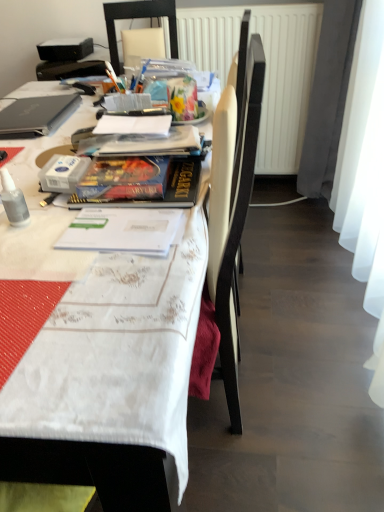
Question: Does white fabric table at upper left have a greater height compared to hardcover book at center?

Choices:
 (A) yes
 (B) no

Answer: (A)

Question: Is white fabric table at upper left looking in the opposite direction of hardcover book at center?

Choices:
 (A) no
 (B) yes

Answer: (A)

Question: From a real-world perspective, is white fabric table at upper left below hardcover book at center?

Choices:
 (A) no
 (B) yes

Answer: (B)

Question: Is white fabric table at upper left thinner than hardcover book at center?

Choices:
 (A) no
 (B) yes

Answer: (A)

Question: Would you say white fabric table at upper left is outside hardcover book at center?

Choices:
 (A) no
 (B) yes

Answer: (B)

Question: In the image, is matte black laptop at upper left positioned in front of or behind white plastic chair at upper center?

Choices:
 (A) front
 (B) behind

Answer: (A)

Question: From the image's perspective, is matte black laptop at upper left above or below white plastic chair at upper center?

Choices:
 (A) above
 (B) below

Answer: (B)

Question: In terms of height, does matte black laptop at upper left look taller or shorter compared to white plastic chair at upper center?

Choices:
 (A) short
 (B) tall

Answer: (A)

Question: From a real-world perspective, is matte black laptop at upper left above or below white plastic chair at upper center?

Choices:
 (A) above
 (B) below

Answer: (B)

Question: In the image, is white plastic chair at upper center on the left side or the right side of white textured radiator at upper center?

Choices:
 (A) right
 (B) left

Answer: (B)

Question: Is white plastic chair at upper center in front of or behind white textured radiator at upper center in the image?

Choices:
 (A) behind
 (B) front

Answer: (B)

Question: Is white plastic chair at upper center spatially inside white textured radiator at upper center, or outside of it?

Choices:
 (A) outside
 (B) inside

Answer: (A)

Question: In terms of height, does white plastic chair at upper center look taller or shorter compared to white textured radiator at upper center?

Choices:
 (A) short
 (B) tall

Answer: (A)

Question: Is point (139, 157) positioned closer to the camera than point (54, 126)?

Choices:
 (A) closer
 (B) farther

Answer: (A)

Question: In the image, is hardcover book at center positioned in front of or behind matte black laptop at upper left?

Choices:
 (A) front
 (B) behind

Answer: (A)